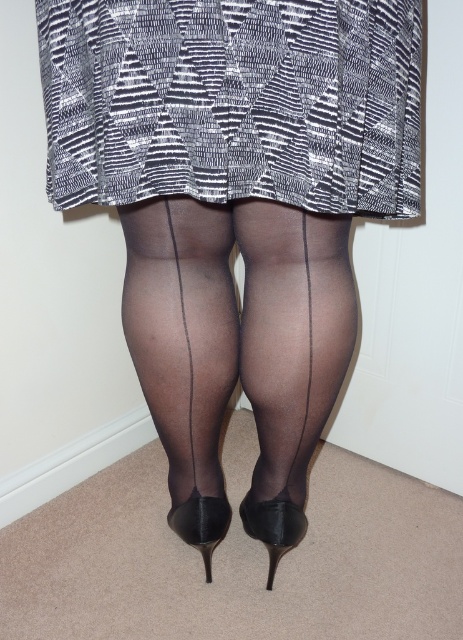
Can you confirm if black textured skirt at center is positioned below black glossy heel at center?

No, black textured skirt at center is not below black glossy heel at center.

This screenshot has width=463, height=640. In order to click on black textured skirt at center in this screenshot , I will do `click(233, 100)`.

Does sheer black stockings at center appear on the right side of black leather high-heeled shoe at center?

In fact, sheer black stockings at center is to the left of black leather high-heeled shoe at center.

Is point (206, 520) farther from viewer compared to point (264, 529)?

No, (206, 520) is in front of (264, 529).

The image size is (463, 640). In order to click on sheer black stockings at center in this screenshot , I will do `click(183, 349)`.

Does point (187, 376) come farther from viewer compared to point (223, 524)?

No, (187, 376) is in front of (223, 524).

Consider the image. Can you confirm if sheer black stockings at center is smaller than black glossy heel at center?

No.

The height and width of the screenshot is (640, 463). Find the location of `sheer black stockings at center`. sheer black stockings at center is located at coordinates (183, 349).